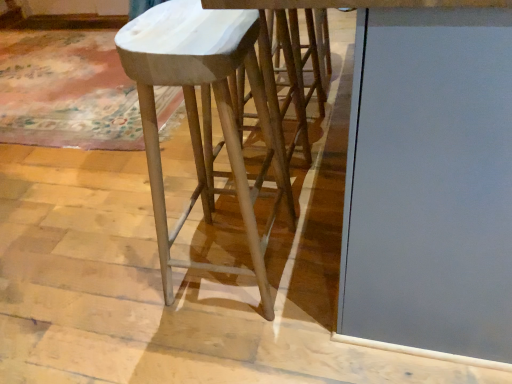
Where is `vacant area that is in front of white marble stool at center`? vacant area that is in front of white marble stool at center is located at coordinates (240, 345).